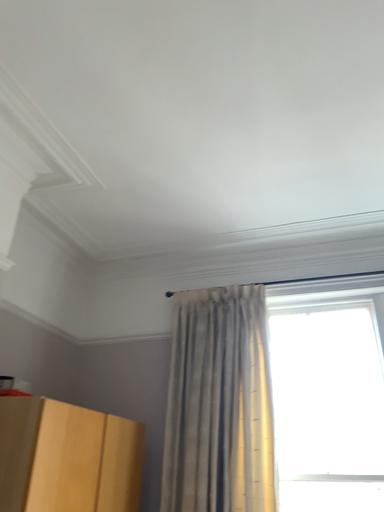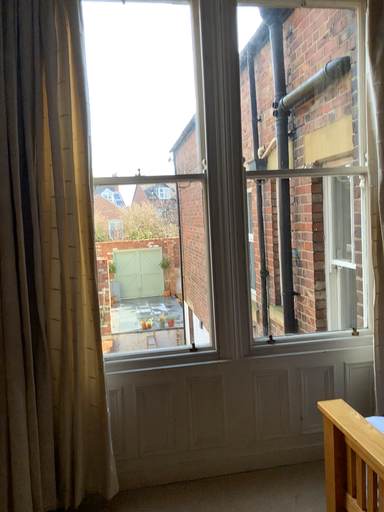
Question: Which way did the camera rotate in the video?

Choices:
 (A) rotated left
 (B) rotated right

Answer: (B)